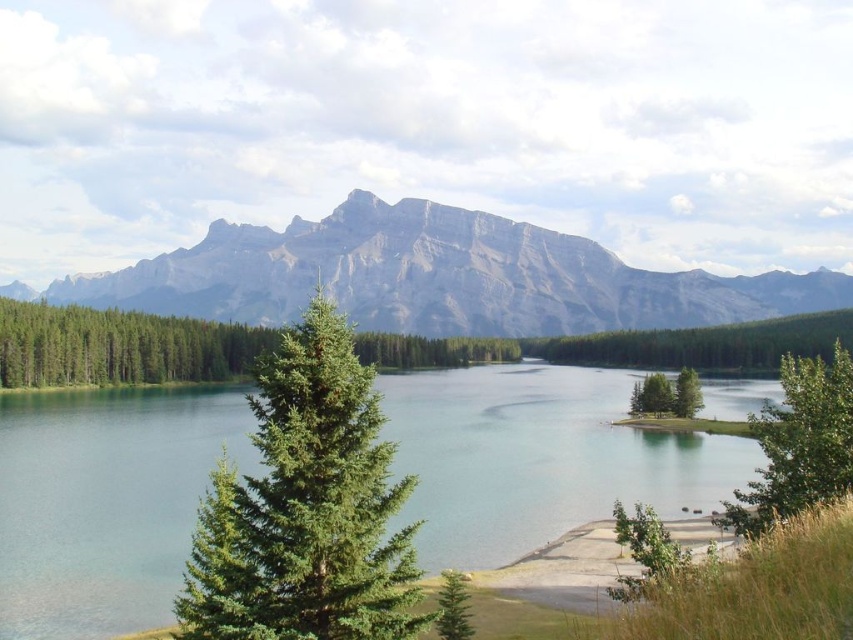
You are standing at the point marked as point (653, 396) in the image. Looking around, you see the green matte tree at center. Based on your location, which direction would you face to have the green matte tree at center directly in front of you?

Since point (653, 396) corresponds to the green matte tree at center, facing forward from that point would have the green matte tree at center directly in front of you.

From the picture: You are a hiker standing at the edge of the clear water at center. You want to climb to the top of the gray rocky mountain at upper center. Based on the scene, can you determine if the mountain is taller than the water body?

The clear water at center has a lesser height compared to gray rocky mountain at upper center, so yes, the mountain is taller than the water body.